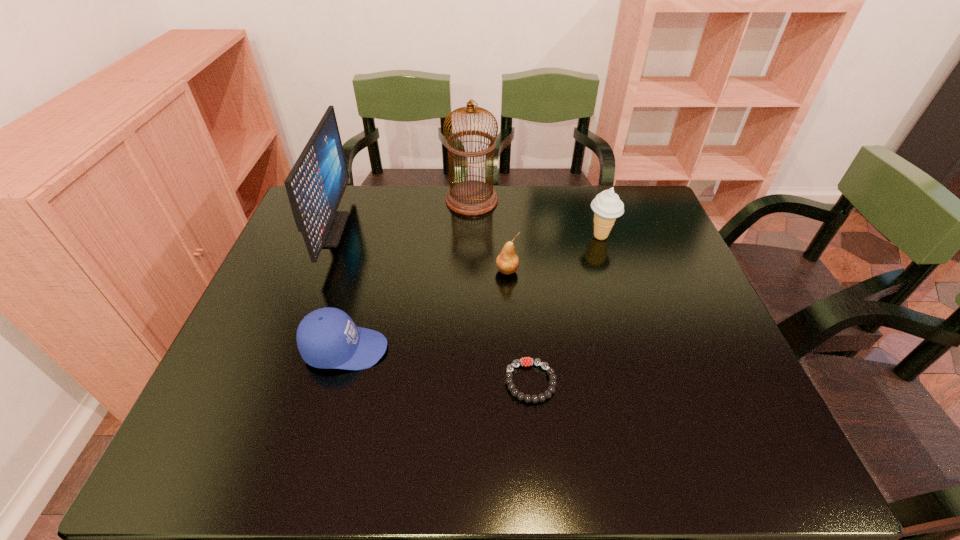
You are a GUI agent. You are given a task and a screenshot of the screen. Output one action in this format:
    pyautogui.click(x=<x>, y=<y>)
    Task: Click on the vacant space at the left edge of the desktop
    This screenshot has width=960, height=540.
    Given the screenshot: What is the action you would take?
    pyautogui.click(x=276, y=383)

Where is `vacant space at the right edge of the desktop`? vacant space at the right edge of the desktop is located at coordinates pos(631,241).

Locate an element on the screen. The height and width of the screenshot is (540, 960). vacant space at the near left corner of the desktop is located at coordinates (192, 452).

I want to click on vacant area between the leftmost object and the fifth tallest object, so click(x=338, y=289).

The height and width of the screenshot is (540, 960). Identify the location of vacant space that is in between the bracelet and the fourth shortest object. (565, 309).

At what (x,y) coordinates should I click in order to perform the action: click on blank region between the birdcage and the fifth object from right to left. Please return your answer as a coordinate pair (x, y). This screenshot has width=960, height=540. Looking at the image, I should click on (409, 275).

Where is `free spot between the birdcage and the pear`? free spot between the birdcage and the pear is located at coordinates (490, 235).

The width and height of the screenshot is (960, 540). I want to click on empty location between the cap and the shortest object, so [x=438, y=366].

This screenshot has width=960, height=540. I want to click on empty space between the rightmost object and the pear, so tap(554, 254).

This screenshot has width=960, height=540. Identify the location of blank region between the bracelet and the fifth object from right to left. (438, 366).